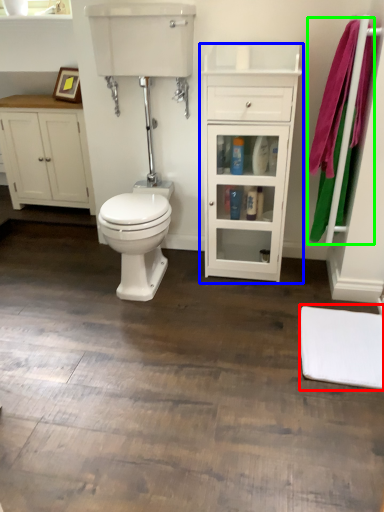
Question: Estimate the real-world distances between objects in this image. Which object is closer to mat (highlighted by a red box), cabinetry (highlighted by a blue box) or bath towel (highlighted by a green box)?

Choices:
 (A) cabinetry
 (B) bath towel

Answer: (B)